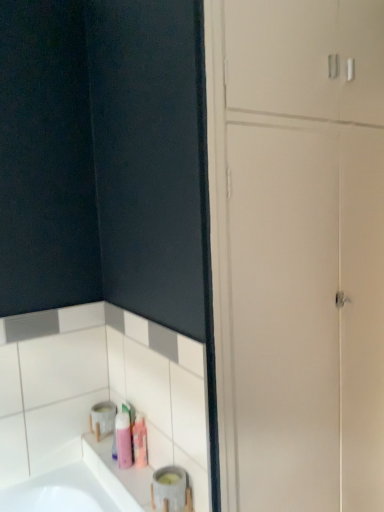
Question: Considering the relative sizes of matte gray container at lower left and pink matte toiletry at lower center, positioned as the first toiletry in right-to-left order, in the image provided, is matte gray container at lower left bigger than pink matte toiletry at lower center, positioned as the first toiletry in right-to-left order,?

Choices:
 (A) yes
 (B) no

Answer: (A)

Question: From a real-world perspective, is matte gray container at lower left beneath pink matte toiletry at lower center, the second toiletry from the left?

Choices:
 (A) no
 (B) yes

Answer: (B)

Question: Is matte gray container at lower left taller than pink matte toiletry at lower center, the second toiletry from the left?

Choices:
 (A) no
 (B) yes

Answer: (A)

Question: Is matte gray container at lower left far from pink matte toiletry at lower center, positioned as the first toiletry in right-to-left order?

Choices:
 (A) yes
 (B) no

Answer: (B)

Question: Is matte gray container at lower left with pink matte toiletry at lower center, positioned as the first toiletry in right-to-left order?

Choices:
 (A) no
 (B) yes

Answer: (A)

Question: Is point (354, 260) positioned closer to the camera than point (122, 438)?

Choices:
 (A) closer
 (B) farther

Answer: (A)

Question: From the image's perspective, is white glossy dresser at lower left located above or below pink matte bottle at lower left, which appears as the 2th toiletry when viewed from the right?

Choices:
 (A) above
 (B) below

Answer: (A)

Question: In the image, is white glossy dresser at lower left positioned in front of or behind pink matte bottle at lower left, which appears as the 2th toiletry when viewed from the right?

Choices:
 (A) front
 (B) behind

Answer: (A)

Question: Considering the positions of white glossy dresser at lower left and pink matte bottle at lower left, which is counted as the 1th toiletry, starting from the left, in the image, is white glossy dresser at lower left taller or shorter than pink matte bottle at lower left, which is counted as the 1th toiletry, starting from the left,?

Choices:
 (A) tall
 (B) short

Answer: (A)

Question: Is pink matte bottle at lower left, which is counted as the 1th toiletry, starting from the left, spatially inside pink matte toiletry at lower center, positioned as the first toiletry in right-to-left order, or outside of it?

Choices:
 (A) outside
 (B) inside

Answer: (A)

Question: From the image's perspective, relative to pink matte toiletry at lower center, positioned as the first toiletry in right-to-left order, is pink matte bottle at lower left, which appears as the 2th toiletry when viewed from the right, above or below?

Choices:
 (A) above
 (B) below

Answer: (B)

Question: From a real-world perspective, is pink matte bottle at lower left, which appears as the 2th toiletry when viewed from the right, physically located above or below pink matte toiletry at lower center, positioned as the first toiletry in right-to-left order?

Choices:
 (A) below
 (B) above

Answer: (A)

Question: Is pink matte bottle at lower left, which appears as the 2th toiletry when viewed from the right, taller or shorter than pink matte toiletry at lower center, positioned as the first toiletry in right-to-left order?

Choices:
 (A) short
 (B) tall

Answer: (A)

Question: Would you say matte gray container at lower left is to the left or to the right of pink matte bottle at lower left, which appears as the 2th toiletry when viewed from the right, in the picture?

Choices:
 (A) left
 (B) right

Answer: (B)

Question: Is matte gray container at lower left in front of or behind pink matte bottle at lower left, which is counted as the 1th toiletry, starting from the left, in the image?

Choices:
 (A) front
 (B) behind

Answer: (A)